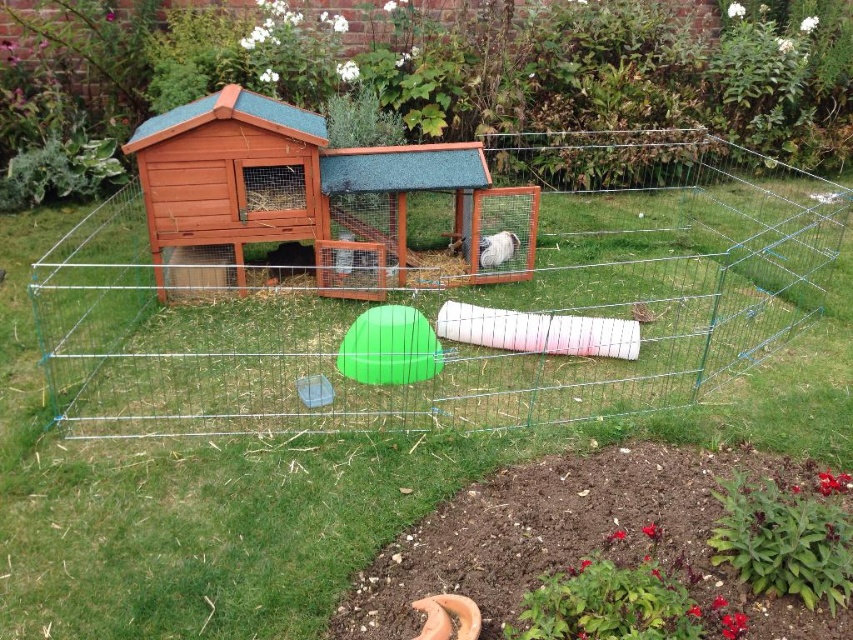
Does green wire fence at center appear over white fluffy rabbit at center?

Yes.

Who is lower down, green wire fence at center or white fluffy rabbit at center?

Positioned lower is white fluffy rabbit at center.

Measure the distance between point (798, 236) and camera.

Point (798, 236) is 18.04 feet away from camera.

I want to click on green wire fence at center, so (457, 298).

How far apart are wooden hut at center and white fluffy rabbit at center?

They are 1.41 meters apart.

Between wooden hut at center and white fluffy rabbit at center, which one has less height?

white fluffy rabbit at center

Where is `wooden hut at center`? Image resolution: width=853 pixels, height=640 pixels. wooden hut at center is located at coordinates (229, 177).

Who is more forward, (178,170) or (184,257)?

Point (178,170)

Identify the location of wooden hut at center. (229, 177).